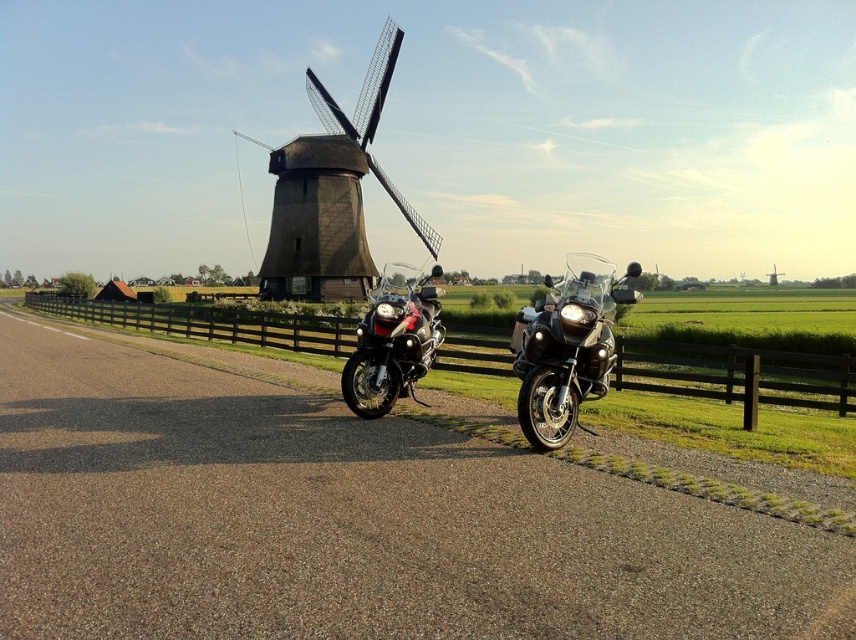
Question: Which of the following is the farthest from the observer?

Choices:
 (A) glossy black motorcycle at center
 (B) brown wooden fence at lower center

Answer: (B)

Question: Is glossy black motorcycle at center to the left of matte black motorcycle at center from the viewer's perspective?

Choices:
 (A) no
 (B) yes

Answer: (A)

Question: Which of the following is the farthest from the observer?

Choices:
 (A) brown wooden windmill at upper center
 (B) brown wooden fence at lower center
 (C) glossy black motorcycle at center

Answer: (A)

Question: Can you confirm if brown wooden windmill at upper center is bigger than matte black motorcycle at center?

Choices:
 (A) no
 (B) yes

Answer: (B)

Question: Can you confirm if brown wooden windmill at upper center is positioned above matte black motorcycle at center?

Choices:
 (A) yes
 (B) no

Answer: (A)

Question: Estimate the real-world distances between objects in this image. Which object is farther from the brown wooden windmill at upper center?

Choices:
 (A) matte black motorcycle at center
 (B) brown wooden fence at lower center

Answer: (A)